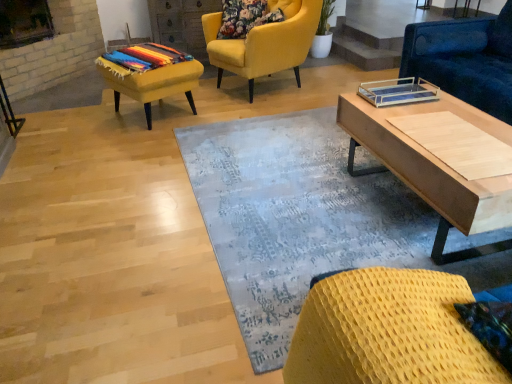
What do you see at coordinates (303, 219) in the screenshot? I see `blue textured rug at center` at bounding box center [303, 219].

Image resolution: width=512 pixels, height=384 pixels. What are the coordinates of `multicolored woven blanket at left` in the screenshot? It's located at (145, 57).

Image resolution: width=512 pixels, height=384 pixels. Describe the element at coordinates (150, 74) in the screenshot. I see `multicolored woven stool at left` at that location.

Find the location of a particular element. The image size is (512, 384). woven yellow chair at lower right, which ranks as the second chair in left-to-right order is located at coordinates (388, 332).

What do you see at coordinates (437, 164) in the screenshot? The width and height of the screenshot is (512, 384). I see `light wood coffee table at right` at bounding box center [437, 164].

Where is `blue fabric couch at upper right, positioned as the first chair in right-to-left order`? This screenshot has height=384, width=512. blue fabric couch at upper right, positioned as the first chair in right-to-left order is located at coordinates (465, 59).

The width and height of the screenshot is (512, 384). I want to click on blue textured rug at center, so click(x=303, y=219).

Which is in front, point (344, 350) or point (504, 196)?

Point (344, 350)

How many degrees apart are the facing directions of woven yellow chair at lower right, which appears as the 1th chair when viewed from the front, and light wood coffee table at right?

The facing directions of woven yellow chair at lower right, which appears as the 1th chair when viewed from the front, and light wood coffee table at right are 180 degrees apart.

From the image's perspective, which one is positioned lower, woven yellow chair at lower right, which is counted as the 3th chair, starting from the back, or light wood coffee table at right?

woven yellow chair at lower right, which is counted as the 3th chair, starting from the back.

Between point (508, 380) and point (127, 51), which one is positioned behind?

Point (127, 51)

In the scene shown: Which of these two, woven yellow chair at lower right, which appears as the 1th chair when viewed from the front, or multicolored woven blanket at left, is thinner?

Thinner between the two is woven yellow chair at lower right, which appears as the 1th chair when viewed from the front.

Is multicolored woven blanket at left at the back of woven yellow chair at lower right, which is counted as the 3th chair, starting from the back?

woven yellow chair at lower right, which is counted as the 3th chair, starting from the back, does not have its back to multicolored woven blanket at left.

From the image's perspective, between woven yellow chair at lower right, marked as the second chair in a right-to-left arrangement, and multicolored woven blanket at left, who is located below?

woven yellow chair at lower right, marked as the second chair in a right-to-left arrangement, from the image's perspective.

Is blue fabric couch at upper right, which ranks as the 3th chair in left-to-right order, positioned in front of multicolored woven stool at left?

Yes.

Does point (497, 114) come in front of point (203, 67)?

Yes.

Could you measure the distance between blue fabric couch at upper right, positioned as the first chair in right-to-left order, and multicolored woven stool at left?

blue fabric couch at upper right, positioned as the first chair in right-to-left order, and multicolored woven stool at left are 6.45 feet apart from each other.

This screenshot has width=512, height=384. In order to click on stool that is above the blue fabric couch at upper right, which ranks as the 3th chair in left-to-right order (from the image's perspective) in this screenshot , I will do `click(150, 74)`.

Is velvet yellow armchair at upper center, the 3th chair viewed from the front, not within multicolored woven blanket at left?

That's correct, velvet yellow armchair at upper center, the 3th chair viewed from the front, is outside of multicolored woven blanket at left.

Can you confirm if velvet yellow armchair at upper center, which is the first chair from back to front, is smaller than multicolored woven blanket at left?

No.

Which is more distant, (318, 22) or (161, 56)?

The point (318, 22) is more distant.

Is the depth of velvet yellow armchair at upper center, the 3th chair viewed from the front, less than that of multicolored woven blanket at left?

No, the depth of velvet yellow armchair at upper center, the 3th chair viewed from the front, is greater than that of multicolored woven blanket at left.

Can you confirm if blue fabric couch at upper right, which ranks as the 3th chair in left-to-right order, is shorter than light wood coffee table at right?

Incorrect, the height of blue fabric couch at upper right, which ranks as the 3th chair in left-to-right order, does not fall short of that of light wood coffee table at right.

From a real-world perspective, is blue fabric couch at upper right, which ranks as the 3th chair in left-to-right order, physically located above or below light wood coffee table at right?

Clearly, from a real-world perspective, blue fabric couch at upper right, which ranks as the 3th chair in left-to-right order, is above light wood coffee table at right.

Consider the image. Between blue fabric couch at upper right, the 2th chair positioned from the back, and light wood coffee table at right, which one appears on the right side from the viewer's perspective?

Positioned to the right is blue fabric couch at upper right, the 2th chair positioned from the back.

Is blue fabric couch at upper right, the 2th chair positioned from the back, next to light wood coffee table at right and touching it?

No, blue fabric couch at upper right, the 2th chair positioned from the back, is not making contact with light wood coffee table at right.

From the image's perspective, is multicolored woven stool at left located above or below light wood coffee table at right?

multicolored woven stool at left is above light wood coffee table at right.

Is light wood coffee table at right completely or partially inside multicolored woven stool at left?

No, light wood coffee table at right is located outside of multicolored woven stool at left.

Which point is more distant from viewer, (150, 56) or (463, 229)?

The point (150, 56) is farther.

From their relative heights in the image, would you say multicolored woven stool at left is taller or shorter than light wood coffee table at right?

Clearly, multicolored woven stool at left is shorter compared to light wood coffee table at right.

Is woven yellow chair at lower right, which is counted as the 3th chair, starting from the back, oriented towards blue textured rug at center?

No, woven yellow chair at lower right, which is counted as the 3th chair, starting from the back, is not facing towards blue textured rug at center.

Is point (449, 284) behind point (307, 203)?

No, (449, 284) is in front of (307, 203).

Based on the photo, is woven yellow chair at lower right, which is counted as the 3th chair, starting from the back, positioned beyond the bounds of blue textured rug at center?

Yes, woven yellow chair at lower right, which is counted as the 3th chair, starting from the back, is outside of blue textured rug at center.

How many degrees apart are the facing directions of woven yellow chair at lower right, marked as the second chair in a right-to-left arrangement, and blue textured rug at center?

90.7 degrees.

Image resolution: width=512 pixels, height=384 pixels. I want to click on chair lying below the light wood coffee table at right (from the image's perspective), so click(x=388, y=332).

This screenshot has height=384, width=512. I want to click on the 2nd chair in front of the multicolored woven blanket at left, so click(388, 332).

Considering their positions, is multicolored woven stool at left positioned further to blue textured rug at center than woven yellow chair at lower right, marked as the second chair in a right-to-left arrangement?

multicolored woven stool at left.

Looking at this image, from the image, which object appears to be farther from light wood coffee table at right, woven yellow chair at lower right, which ranks as the second chair in left-to-right order, or blue textured rug at center?

woven yellow chair at lower right, which ranks as the second chair in left-to-right order, is further to light wood coffee table at right.

Which object lies further to the anchor point woven yellow chair at lower right, marked as the second chair in a right-to-left arrangement, velvet yellow armchair at upper center, which is the first chair from back to front, or multicolored woven stool at left?

velvet yellow armchair at upper center, which is the first chair from back to front.

In the scene shown: Which object lies further to the anchor point multicolored woven stool at left, woven yellow chair at lower right, which ranks as the second chair in left-to-right order, or multicolored woven blanket at left?

Among the two, woven yellow chair at lower right, which ranks as the second chair in left-to-right order, is located further to multicolored woven stool at left.

Looking at this image, which object lies further to the anchor point woven yellow chair at lower right, marked as the second chair in a right-to-left arrangement, blue textured rug at center or multicolored woven stool at left?

multicolored woven stool at left is further to woven yellow chair at lower right, marked as the second chair in a right-to-left arrangement.

When comparing their distances from light wood coffee table at right, does velvet yellow armchair at upper center, arranged as the 1th chair when viewed from the left, or blue textured rug at center seem further?

velvet yellow armchair at upper center, arranged as the 1th chair when viewed from the left.

Estimate the real-world distances between objects in this image. Which object is further from woven yellow chair at lower right, which appears as the 1th chair when viewed from the front, blue fabric couch at upper right, which ranks as the 3th chair in left-to-right order, or light wood coffee table at right?

blue fabric couch at upper right, which ranks as the 3th chair in left-to-right order, is further to woven yellow chair at lower right, which appears as the 1th chair when viewed from the front.

Which object lies nearer to the anchor point multicolored woven blanket at left, blue fabric couch at upper right, which ranks as the 3th chair in left-to-right order, or light wood coffee table at right?

light wood coffee table at right lies closer to multicolored woven blanket at left than the other object.

Locate an element on the screen. Image resolution: width=512 pixels, height=384 pixels. coffee table positioned between woven yellow chair at lower right, which is counted as the 3th chair, starting from the back, and multicolored woven blanket at left from near to far is located at coordinates (437, 164).

Image resolution: width=512 pixels, height=384 pixels. I want to click on coffee table between velvet yellow armchair at upper center, the 3th chair viewed from the front, and blue fabric couch at upper right, the 2th chair viewed from the front, in the horizontal direction, so click(x=437, y=164).

Find the location of a particular element. This screenshot has width=512, height=384. blanket between woven yellow chair at lower right, which ranks as the second chair in left-to-right order, and velvet yellow armchair at upper center, the 3th chair from the right, along the z-axis is located at coordinates 145,57.

What are the coordinates of `blanket between blue textured rug at center and velvet yellow armchair at upper center, the 3th chair viewed from the front, along the z-axis` in the screenshot? It's located at (145, 57).